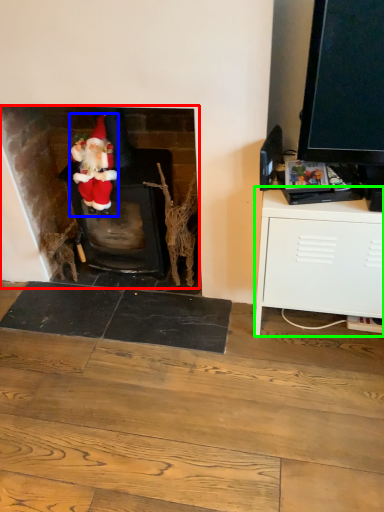
Question: Which object is positioned closest to fireplace (highlighted by a red box)? Select from person (highlighted by a blue box) and cabinetry (highlighted by a green box).

Choices:
 (A) person
 (B) cabinetry

Answer: (A)